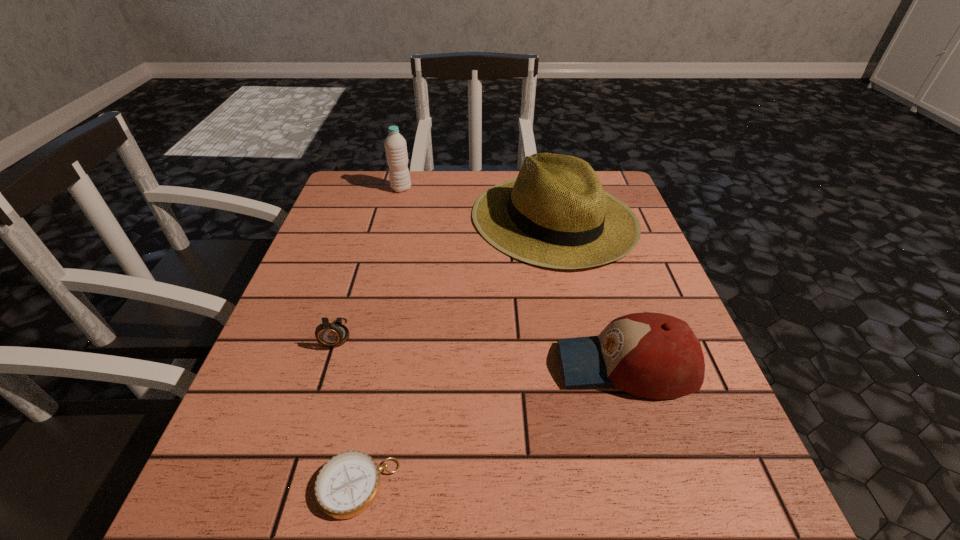
Find the location of a particular element. Image resolution: width=960 pixels, height=540 pixels. vacant space located on the front-facing side of the baseball cap is located at coordinates (529, 366).

The width and height of the screenshot is (960, 540). Identify the location of free space located on the front-facing side of the baseball cap. (348, 366).

You are a GUI agent. You are given a task and a screenshot of the screen. Output one action in this format:
    pyautogui.click(x=<x>, y=<y>)
    Task: Click on the vacant space situated on the face of the taller compass
    The width and height of the screenshot is (960, 540).
    Given the screenshot: What is the action you would take?
    pyautogui.click(x=276, y=532)

I want to click on vacant area located 0.320m on the right of the nearer compass, so click(624, 487).

Where is `water bottle located in the far edge section of the desktop`? water bottle located in the far edge section of the desktop is located at coordinates (395, 145).

This screenshot has height=540, width=960. What are the coordinates of `sunhat present at the far edge` in the screenshot? It's located at (556, 214).

Locate an element on the screen. object that is at the near edge is located at coordinates (347, 485).

Image resolution: width=960 pixels, height=540 pixels. In order to click on water bottle that is positioned at the left edge in this screenshot , I will do `click(395, 145)`.

The image size is (960, 540). I want to click on sunhat at the right edge, so click(556, 214).

What are the coordinates of `baseball cap that is positioned at the right edge` in the screenshot? It's located at (652, 355).